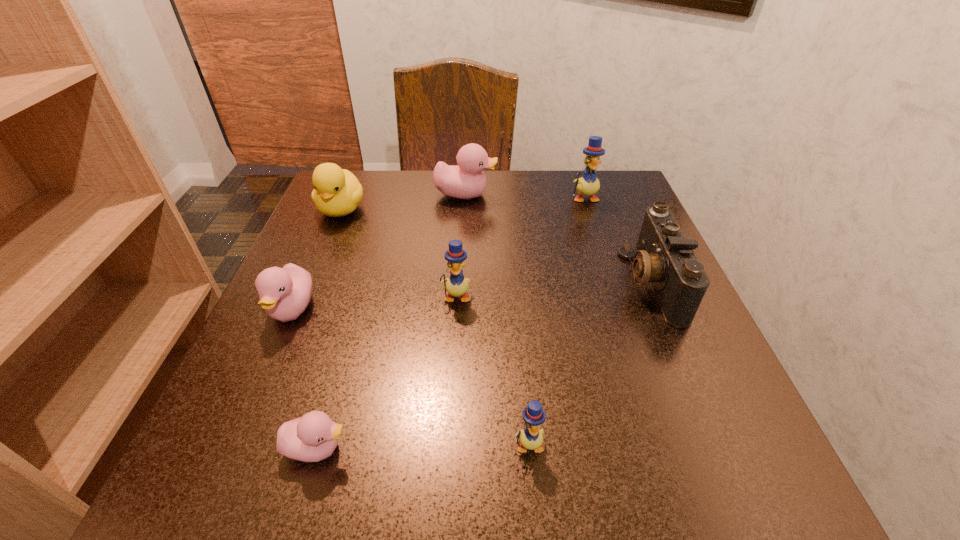
The width and height of the screenshot is (960, 540). Identify the location of free region at the far edge. (492, 184).

In the image, there is a desktop. In order to click on vacant space at the near edge in this screenshot , I will do `click(547, 454)`.

The height and width of the screenshot is (540, 960). I want to click on blank space at the left edge of the desktop, so click(x=300, y=343).

Identify the location of free space at the right edge of the desktop. (637, 332).

Where is `blank area at the far right corner`? This screenshot has width=960, height=540. blank area at the far right corner is located at coordinates (581, 175).

At what (x,y) coordinates should I click in order to perform the action: click on blank space at the near right corner of the desktop. Please return your answer as a coordinate pair (x, y). This screenshot has height=540, width=960. Looking at the image, I should click on tap(786, 498).

I want to click on vacant area that lies between the leftmost pink duckling and the camera, so click(x=472, y=296).

Find the location of `free space between the duck and the third object from right to left`. free space between the duck and the third object from right to left is located at coordinates click(435, 327).

Locate an element on the screen. free space between the camera and the duck is located at coordinates (496, 246).

Image resolution: width=960 pixels, height=540 pixels. I want to click on free space between the camera and the biggest pink duckling, so click(559, 238).